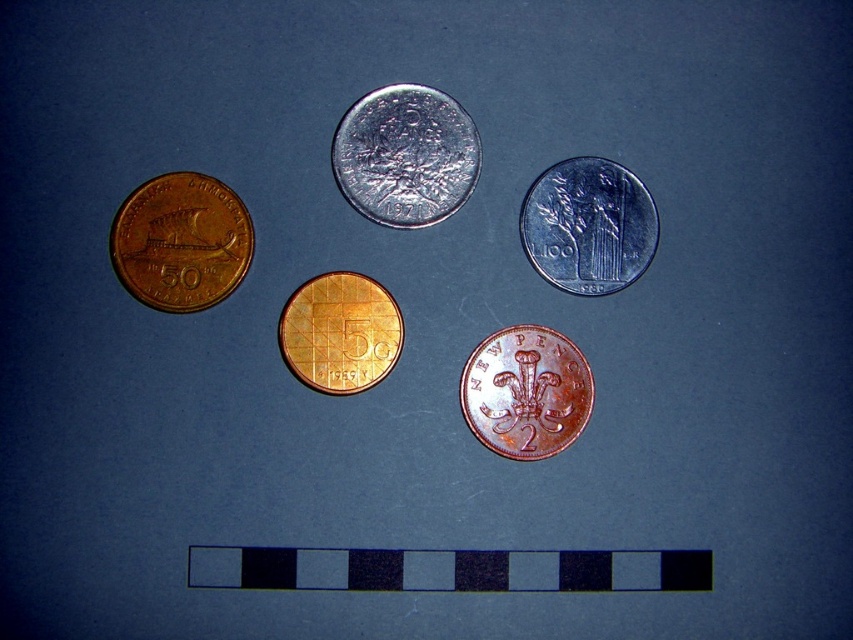
Does point (572, 176) come in front of point (325, 378)?

No, it is not.

Which is above, satin silver coin at upper right or gold-plated coin at center?

satin silver coin at upper right

Does point (596, 248) come farther from viewer compared to point (344, 324)?

Yes, point (596, 248) is behind point (344, 324).

The height and width of the screenshot is (640, 853). Identify the location of satin silver coin at upper right. (589, 225).

In the scene shown: Does shiny silver coin at center have a larger size compared to gold-plated coin at center?

Correct, shiny silver coin at center is larger in size than gold-plated coin at center.

Based on the photo, measure the distance between shiny silver coin at center and camera.

shiny silver coin at center is 1.26 meters away from camera.

Find the location of a particular element. This screenshot has width=853, height=640. shiny silver coin at center is located at coordinates (405, 156).

Between shiny silver coin at center and satin silver coin at upper right, which one appears on the left side from the viewer's perspective?

→ Positioned to the left is shiny silver coin at center.

Is shiny silver coin at center bigger than satin silver coin at upper right?

Yes, shiny silver coin at center is bigger than satin silver coin at upper right.

Is point (405, 90) less distant than point (554, 182)?

Yes.

Identify the location of shiny silver coin at center. (405, 156).